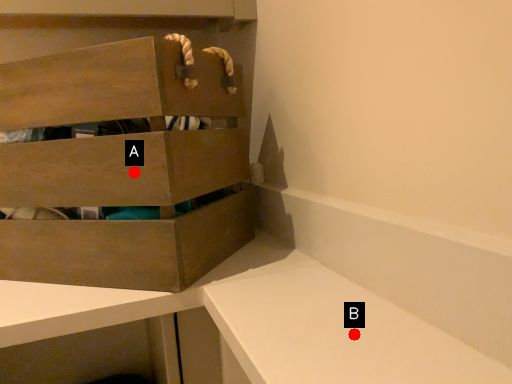
Question: Two points are circled on the image, labeled by A and B beside each circle. Which point is farther to the camera?

Choices:
 (A) A is further
 (B) B is further

Answer: (A)